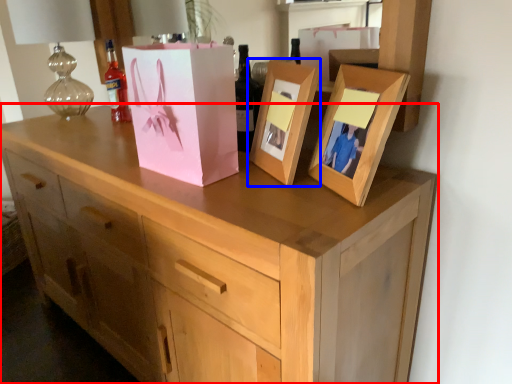
Question: Which point is closer to the camera, chest of drawers (highlighted by a red box) or picture frame (highlighted by a blue box)?

Choices:
 (A) chest of drawers
 (B) picture frame

Answer: (A)